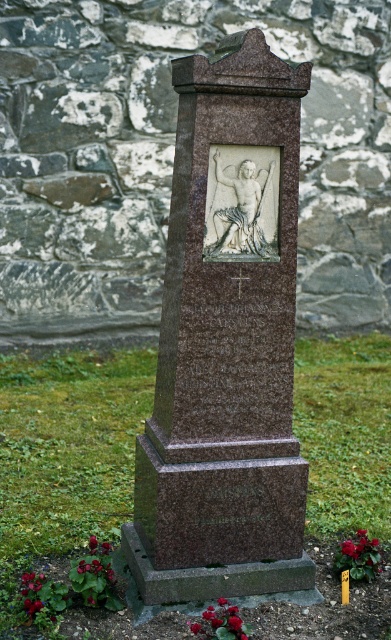
Question: Does brown polished stone monument at center appear over vivid red petals at lower right?

Choices:
 (A) no
 (B) yes

Answer: (B)

Question: Is brown polished stone at center to the right of smooth red petals at lower center from the viewer's perspective?

Choices:
 (A) no
 (B) yes

Answer: (A)

Question: Considering the relative positions of smooth red petals at lower center and vivid red petals at lower left in the image provided, where is smooth red petals at lower center located with respect to vivid red petals at lower left?

Choices:
 (A) left
 (B) right

Answer: (B)

Question: Which of the following is the farthest from the observer?

Choices:
 (A) brown polished stone at center
 (B) vivid red petals at lower left

Answer: (A)

Question: Among these objects, which one is farthest from the camera?

Choices:
 (A) smooth red petals at lower center
 (B) vivid red petals at lower right
 (C) brown polished stone at center
 (D) vivid red petals at lower left

Answer: (C)

Question: Based on their relative distances, which object is farther from the brown polished stone at center?

Choices:
 (A) vivid red petals at lower left
 (B) brown polished stone monument at center
 (C) smooth red petals at lower center

Answer: (C)